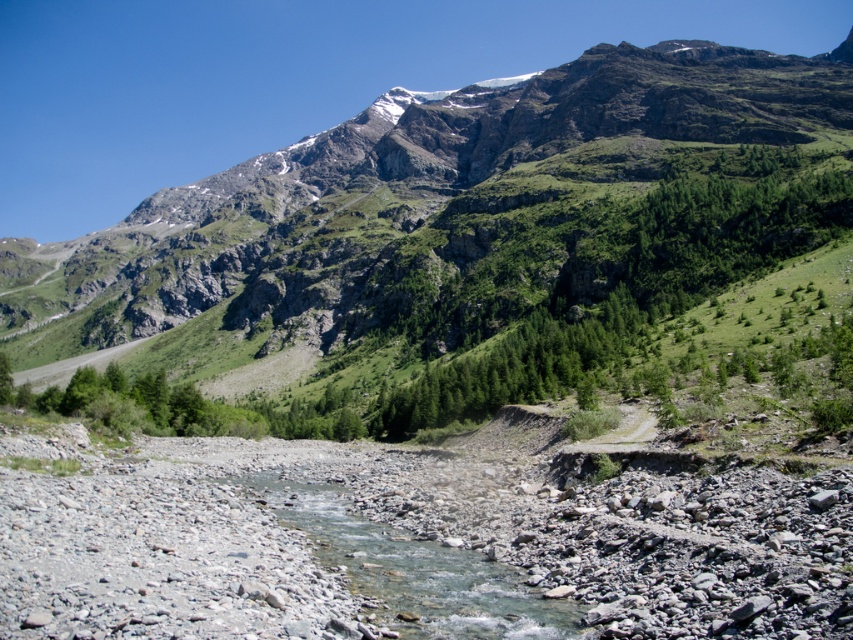
Does green rocky mountain at upper center have a greater height compared to clear water at center?

Yes.

Does point (670, 81) lie behind point (312, 550)?

That is True.

I want to click on green rocky mountain at upper center, so click(469, 211).